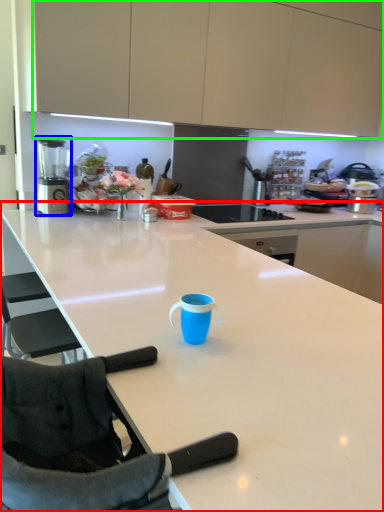
Question: Based on their relative distances, which object is farther from countertop (highlighted by a red box)? Choose from blender (highlighted by a blue box) and cabinetry (highlighted by a green box).

Choices:
 (A) blender
 (B) cabinetry

Answer: (B)